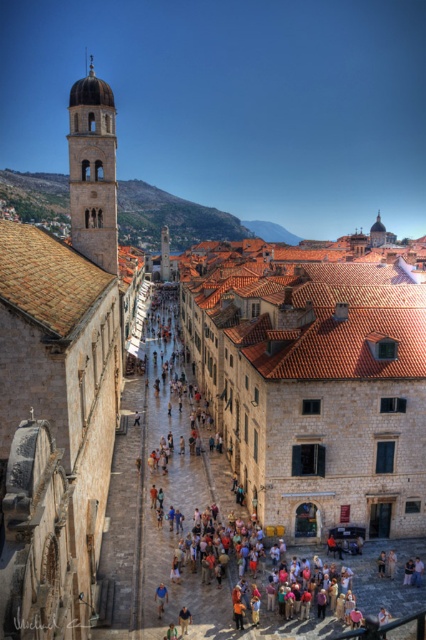
Question: Can you confirm if matte stone tower at upper left is positioned below light brown leather jacket at center?

Choices:
 (A) no
 (B) yes

Answer: (A)

Question: Which point is farther from the camera taking this photo?

Choices:
 (A) (88, 195)
 (B) (163, 230)

Answer: (B)

Question: Which object is closer to the camera taking this photo?

Choices:
 (A) blue fabric shirt at center
 (B) light brown leather jacket at center
 (C) matte stone tower at upper left

Answer: (B)

Question: Is smooth stone tower at center above light brown leather jacket at center?

Choices:
 (A) yes
 (B) no

Answer: (A)

Question: Is matte stone tower at upper left closer to the viewer compared to light brown leather jacket at center?

Choices:
 (A) no
 (B) yes

Answer: (A)

Question: Which of these objects is positioned farthest from the light brown leather jacket at center?

Choices:
 (A) smooth stone tower at center
 (B) matte stone tower at upper left
 (C) blue fabric shirt at center

Answer: (A)